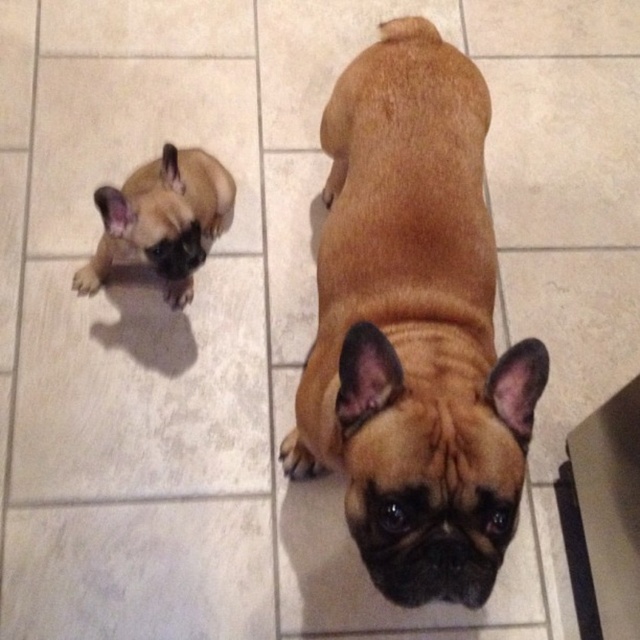
Is the position of brown matte dog at center less distant than that of brown matte french bulldog at upper left?

Yes, brown matte dog at center is closer to the viewer.

Who is higher up, brown matte dog at center or brown matte french bulldog at upper left?

brown matte french bulldog at upper left

The image size is (640, 640). What are the coordinates of `brown matte dog at center` in the screenshot? It's located at (413, 326).